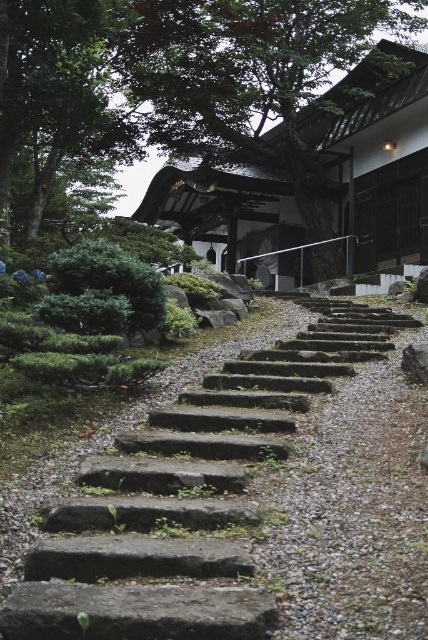
Does gray stone stairs at center appear on the right side of green leafy tree at upper left?

Yes, gray stone stairs at center is to the right of green leafy tree at upper left.

Does point (198, 577) come farther from viewer compared to point (18, 42)?

No, (198, 577) is closer to viewer.

Describe the element at coordinates (186, 499) in the screenshot. I see `gray stone stairs at center` at that location.

Where is `gray stone stairs at center`? Image resolution: width=428 pixels, height=640 pixels. gray stone stairs at center is located at coordinates (186, 499).

Does green leafy tree at upper left appear over gray stone at upper center?

Yes, green leafy tree at upper left is above gray stone at upper center.

Between green leafy tree at upper left and gray stone at upper center, which one appears on the right side from the viewer's perspective?

From the viewer's perspective, gray stone at upper center appears more on the right side.

Which is behind, point (86, 76) or point (419, 349)?

Point (86, 76)

Identify the location of green leafy tree at upper left. This screenshot has height=640, width=428. (61, 90).

What do you see at coordinates (186, 499) in the screenshot? The width and height of the screenshot is (428, 640). I see `gray stone stairs at center` at bounding box center [186, 499].

Measure the distance between gray stone stairs at center and green leafy tree at upper center.

They are 56.84 feet apart.

Is point (32, 595) less distant than point (211, 124)?

Yes.

Identify the location of gray stone stairs at center. (186, 499).